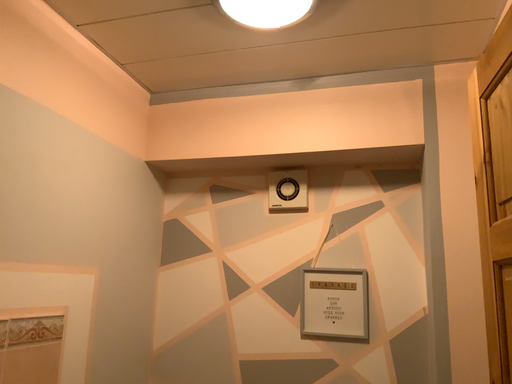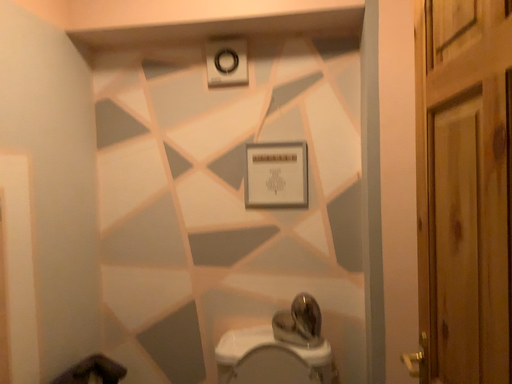
Question: Which way did the camera rotate in the video?

Choices:
 (A) rotated downward
 (B) rotated upward

Answer: (A)